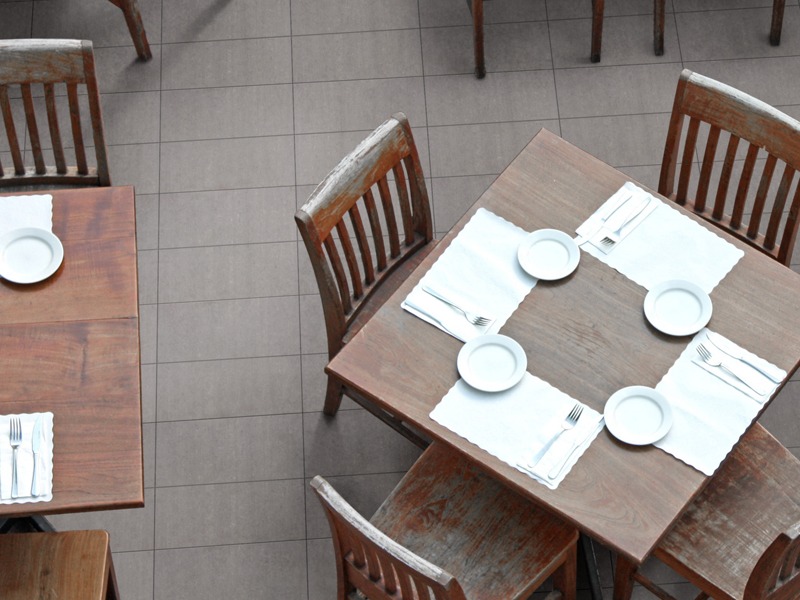
The height and width of the screenshot is (600, 800). Find the location of `chair`. chair is located at coordinates (342, 267), (396, 546), (738, 535), (748, 151), (33, 124).